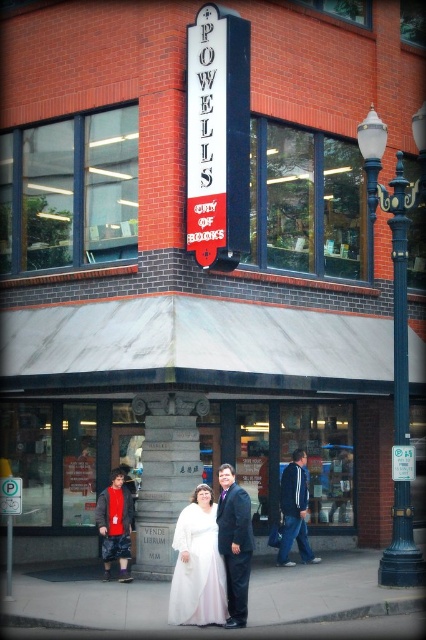
You are a customer at Powell City of Books and see the white satin dress at center and the white satin robe at lower left. Which item of clothing is bigger in size?

The white satin dress at center is larger in size compared to the white satin robe at lower left.

You are standing in front of Powell City of Books. You want to reach a point that is 11.21 meters away from you. Is the point at coordinates point (221, 557) within the bookstore building?

The distance of point (221, 557) from viewer is 11.21 meters, so yes, the point at coordinates point (221, 557) is within the bookstore building since it is exactly 11.21 meters away from you.

You are a customer standing in front of the store and see the white satin dress at center and the white satin robe at lower left. Which item is closer to you?

The white satin dress at center is closer to you because it is in front of the white satin robe at lower left.